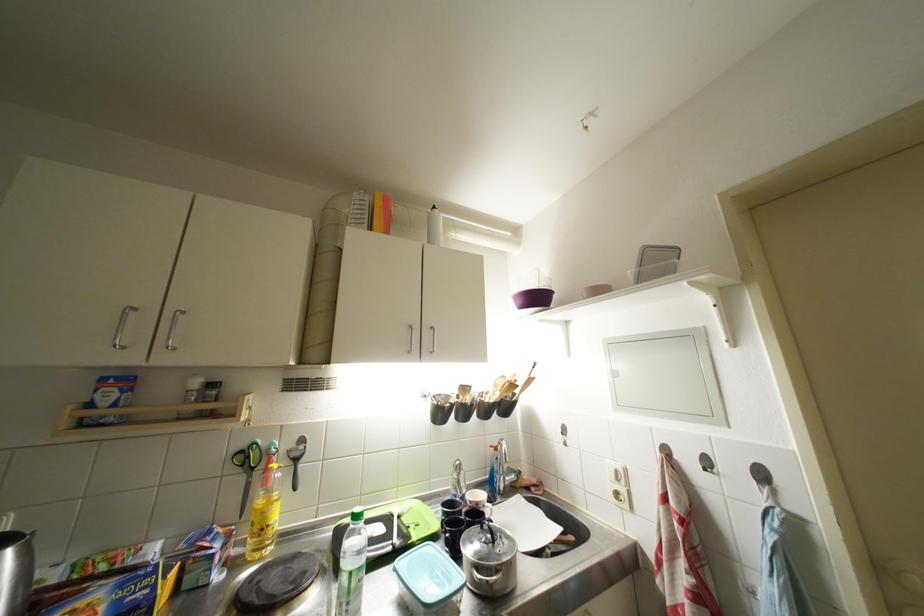
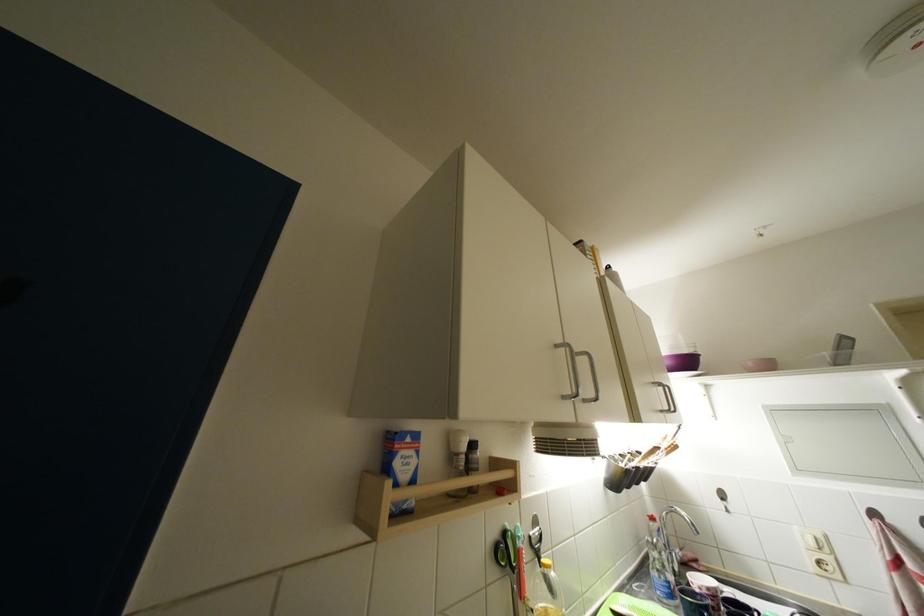
In the second image, find the point that corresponds to point (104, 400) in the first image.

(404, 467)